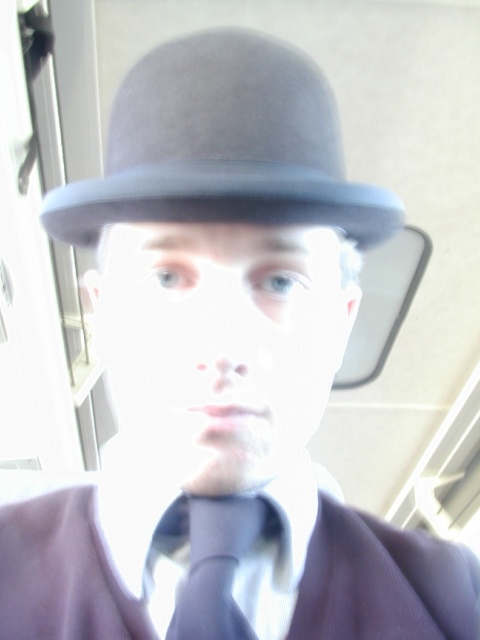
Does matte gray fedora at upper center have a greater width compared to matte purple suit at center?

No.

Does matte gray fedora at upper center have a lesser width compared to matte purple suit at center?

Yes, matte gray fedora at upper center is thinner than matte purple suit at center.

This screenshot has width=480, height=640. I want to click on matte gray fedora at upper center, so click(x=224, y=147).

Based on the photo, does matte gray fedora at upper center have a smaller size compared to matte blue tie at center?

Incorrect, matte gray fedora at upper center is not smaller in size than matte blue tie at center.

Which of these two, matte gray fedora at upper center or matte blue tie at center, stands taller?

matte gray fedora at upper center is taller.

What do you see at coordinates (224, 147) in the screenshot?
I see `matte gray fedora at upper center` at bounding box center [224, 147].

At what (x,y) coordinates should I click in order to perform the action: click on matte gray fedora at upper center. Please return your answer as a coordinate pair (x, y). Looking at the image, I should click on (224, 147).

Between matte purple suit at center and matte blue tie at center, which one appears on the right side from the viewer's perspective?

From the viewer's perspective, matte purple suit at center appears more on the right side.

Can you confirm if matte purple suit at center is smaller than matte blue tie at center?

No.

Is point (304, 576) behind point (260, 518)?

That is True.

You are a GUI agent. You are given a task and a screenshot of the screen. Output one action in this format:
    pyautogui.click(x=<x>, y=<y>)
    Task: Click on the matte purple suit at center
    
    Given the screenshot: What is the action you would take?
    pyautogui.click(x=383, y=580)